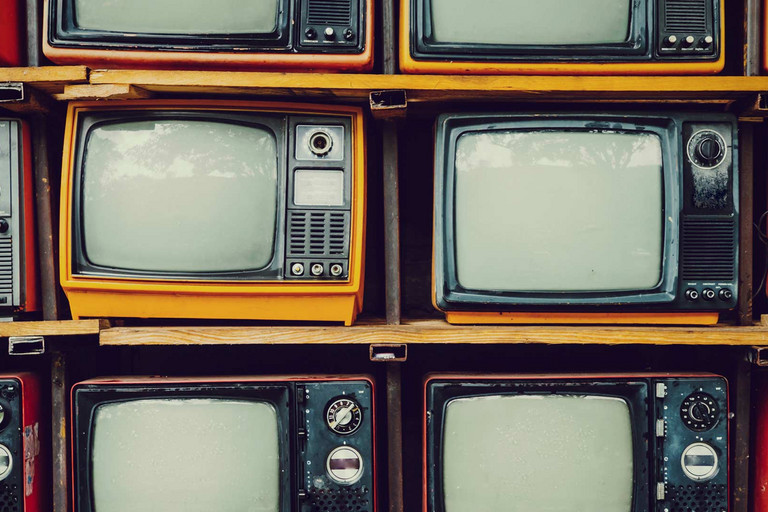
This screenshot has height=512, width=768. I want to click on big tv knob, so click(x=323, y=141), click(x=700, y=148), click(x=707, y=406), click(x=341, y=411), click(x=0, y=463).